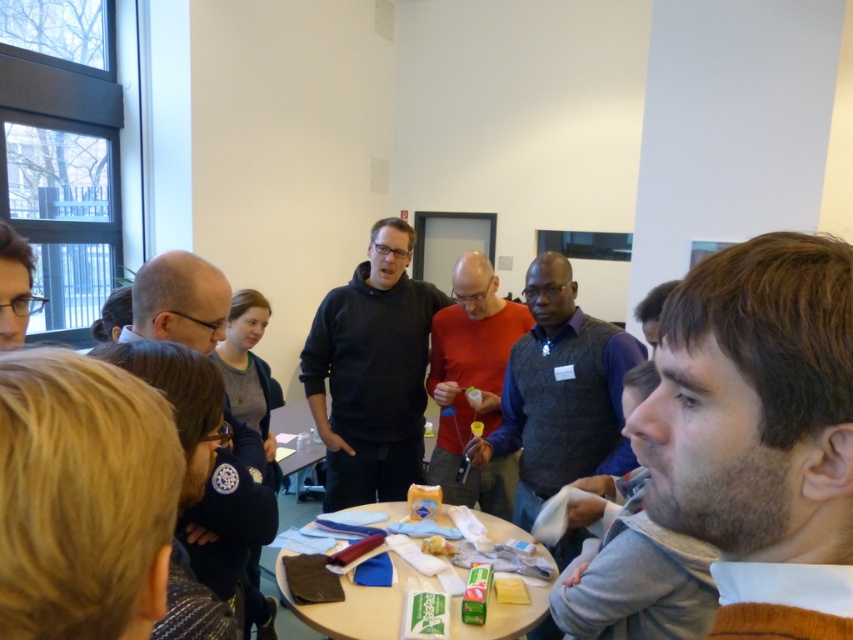
Does brown fuzzy hair at center lie behind wooden round table at center?

No, it is not.

Can you confirm if brown fuzzy hair at center is shorter than wooden round table at center?

No, brown fuzzy hair at center is not shorter than wooden round table at center.

I want to click on brown fuzzy hair at center, so click(759, 432).

Does brown fuzzy hair at center have a lesser width compared to dark gray sweater at center?

Yes.

Can you confirm if brown fuzzy hair at center is wider than dark gray sweater at center?

No, brown fuzzy hair at center is not wider than dark gray sweater at center.

The width and height of the screenshot is (853, 640). Identify the location of brown fuzzy hair at center. (759, 432).

Which is below, brown fuzzy hair at center or wooden table at center?

wooden table at center

Can you confirm if brown fuzzy hair at center is smaller than wooden table at center?

Yes.

Locate an element on the screen. Image resolution: width=853 pixels, height=640 pixels. brown fuzzy hair at center is located at coordinates (759, 432).

Where is `brown fuzzy hair at center`? The height and width of the screenshot is (640, 853). brown fuzzy hair at center is located at coordinates (759, 432).